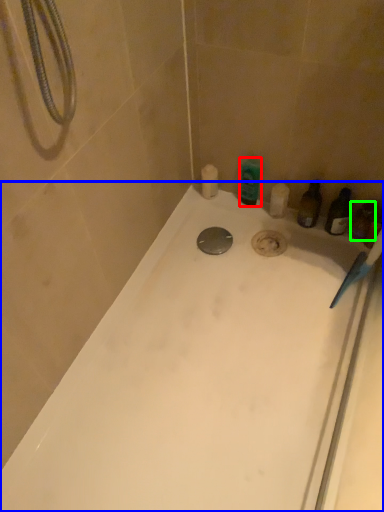
Question: Estimate the real-world distances between objects in this image. Which object is closer to toiletry (highlighted by a red box), bathtub (highlighted by a blue box) or toiletry (highlighted by a green box)?

Choices:
 (A) bathtub
 (B) toiletry

Answer: (B)